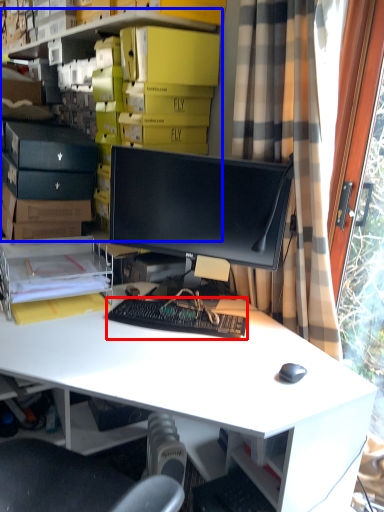
Question: Which object appears farthest to the camera in this image, computer keyboard (highlighted by a red box) or bookshelf (highlighted by a blue box)?

Choices:
 (A) computer keyboard
 (B) bookshelf

Answer: (B)